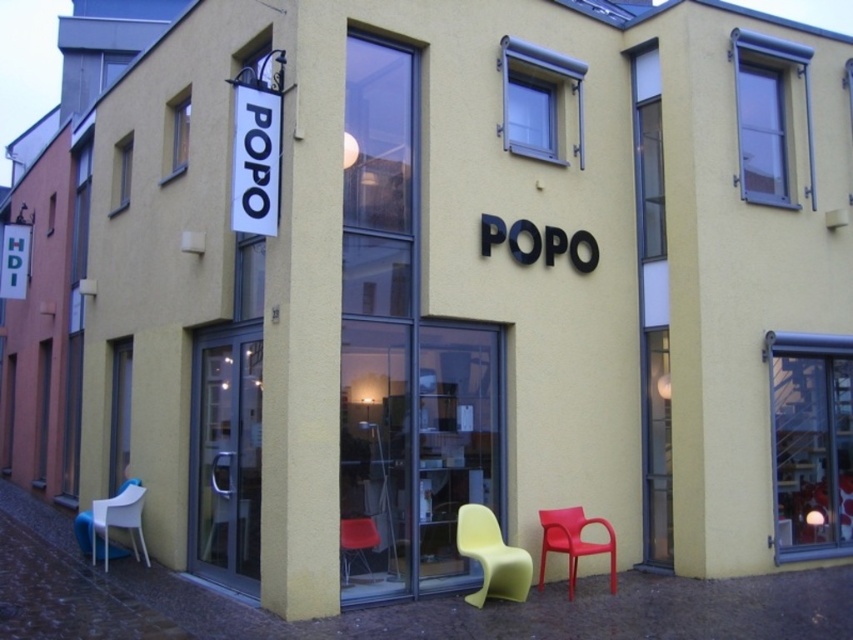
You are a customer entering the store through the large glass doors. You see a white plastic chair at lower left and a matte orange chair at center. Which chair would you need to move if you want to create space near the entrance?

The white plastic chair at lower left has a larger size compared to matte orange chair at center, so moving the white plastic chair at lower left would create more space near the entrance.

You are standing outside the building and see the entrance. There is a point marked at coordinates (x=573, y=541). What object is located at this point?

The point at (x=573, y=541) is where the matte plastic chair at lower right is located.

You are standing in front of the building and want to place a 10 feet wide banner between the white plastic chair at lower left and the matte plastic chair at lower right. Can the banner fit between them?

The distance between the white plastic chair at lower left and the matte plastic chair at lower right is 15.64 feet, which is wider than the 10 feet banner. Therefore, the banner can fit between them.